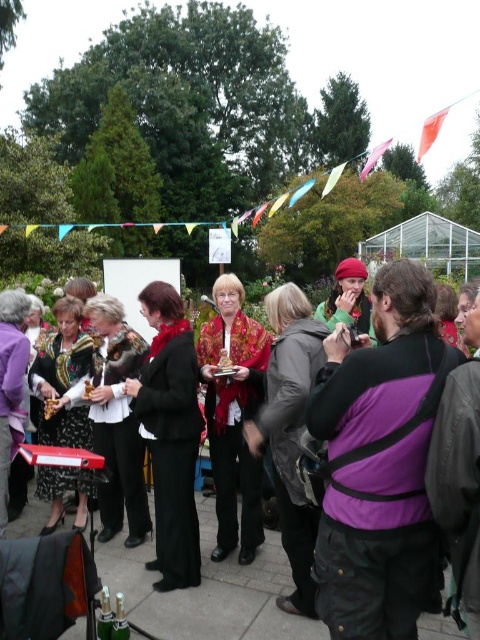
Question: Does floral-patterned scarf at center lie in front of black velvet dress at center?

Choices:
 (A) yes
 (B) no

Answer: (A)

Question: Is floral-patterned fabric dress at lower left closer to camera compared to purple fabric jacket at lower left?

Choices:
 (A) yes
 (B) no

Answer: (A)

Question: Which of the following is the closest to the observer?

Choices:
 (A) purple fabric at center
 (B) floral-patterned fabric dress at lower left
 (C) black matte jacket at center

Answer: (A)

Question: Can you confirm if floral-patterned scarf at center is positioned to the left of floral-patterned fabric dress at lower left?

Choices:
 (A) yes
 (B) no

Answer: (B)

Question: Which point is closer to the camera?

Choices:
 (A) dark gray jacket at center
 (B) black matte jacket at center

Answer: (A)

Question: Estimate the real-world distances between objects in this image. Which object is closer to the floral-patterned scarf at center?

Choices:
 (A) purple fabric jacket at lower left
 (B) green fabric scarf at center
 (C) purple fabric at center
 (D) dark gray jacket at center

Answer: (D)